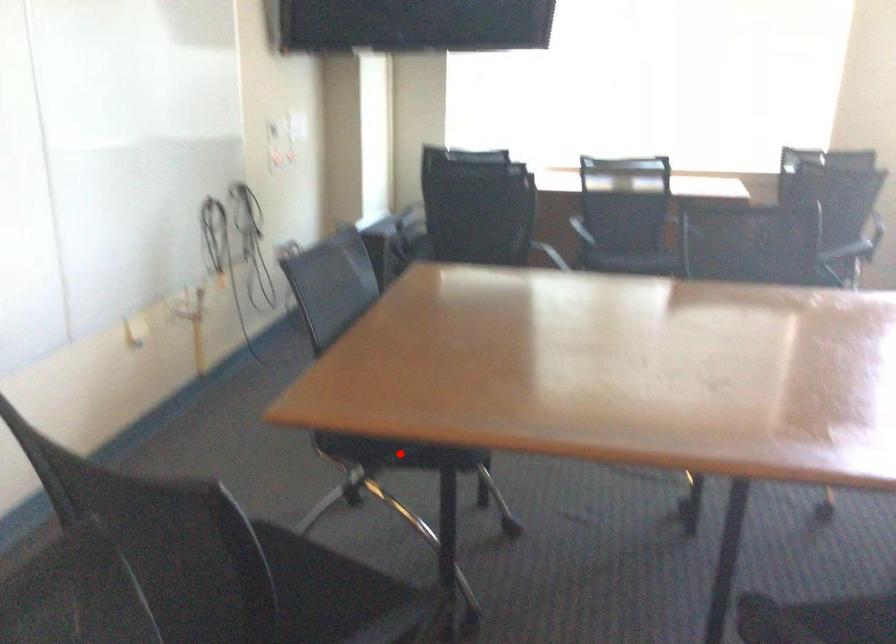
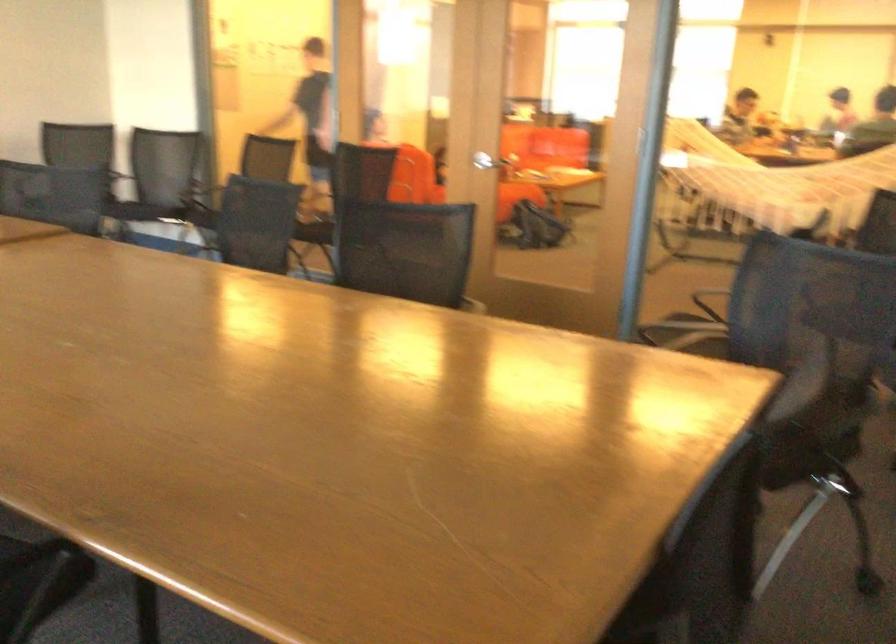
Question: I am providing you with two images of the same scene from different viewpoints. A red point is marked on the first image. Can you still see the location of the red point in image 2?

Choices:
 (A) Yes
 (B) No

Answer: (B)